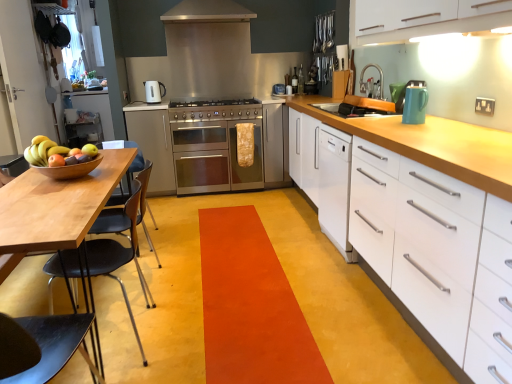
Question: Does white matte cabinet at right, positioned as the first cabinetry in right-to-left order, have a lesser height compared to stainless steel oven at center, which is counted as the 2th cabinetry, starting from the right?

Choices:
 (A) yes
 (B) no

Answer: (B)

Question: Does white matte cabinet at right, positioned as the 3th cabinetry in back-to-front order, have a greater width compared to stainless steel oven at center, which is counted as the 2th cabinetry, starting from the right?

Choices:
 (A) yes
 (B) no

Answer: (B)

Question: From a real-world perspective, is white matte cabinet at right, positioned as the first cabinetry in right-to-left order, beneath stainless steel oven at center, placed as the second cabinetry when sorted from front to back?

Choices:
 (A) no
 (B) yes

Answer: (B)

Question: From the image's perspective, is white matte cabinet at right, which ranks as the 1th cabinetry in front-to-back order, on top of stainless steel oven at center, placed as the second cabinetry when sorted from front to back?

Choices:
 (A) no
 (B) yes

Answer: (A)

Question: Does white matte cabinet at right, which ranks as the 1th cabinetry in front-to-back order, contain stainless steel oven at center, which is counted as the 2th cabinetry, starting from the right?

Choices:
 (A) yes
 (B) no

Answer: (B)

Question: From the image's perspective, is shiny wooden bowl at left positioned above or below white glossy cabinet at upper left, marked as the 1th cabinetry in a left-to-right arrangement?

Choices:
 (A) below
 (B) above

Answer: (A)

Question: Based on their sizes in the image, would you say shiny wooden bowl at left is bigger or smaller than white glossy cabinet at upper left, which ranks as the 3th cabinetry in right-to-left order?

Choices:
 (A) small
 (B) big

Answer: (A)

Question: Looking at their shapes, would you say shiny wooden bowl at left is wider or thinner than white glossy cabinet at upper left, the 1th cabinetry positioned from the back?

Choices:
 (A) wide
 (B) thin

Answer: (B)

Question: Based on their positions, is shiny wooden bowl at left located to the left or right of white glossy cabinet at upper left, acting as the third cabinetry starting from the front?

Choices:
 (A) left
 (B) right

Answer: (B)

Question: From the image's perspective, is stainless steel oven at center, the 2th cabinetry positioned from the back, located above or below black plastic chair at left?

Choices:
 (A) below
 (B) above

Answer: (B)

Question: Does point (161, 130) appear closer or farther from the camera than point (101, 231)?

Choices:
 (A) farther
 (B) closer

Answer: (A)

Question: Based on their positions, is stainless steel oven at center, which is counted as the 2th cabinetry, starting from the right, located to the left or right of black plastic chair at left?

Choices:
 (A) right
 (B) left

Answer: (B)

Question: In terms of height, does stainless steel oven at center, which is counted as the 2th cabinetry, starting from the right, look taller or shorter compared to black plastic chair at left?

Choices:
 (A) short
 (B) tall

Answer: (B)

Question: Looking at the image, does wooden bowl at left seem bigger or smaller compared to stainless steel oven at center, which is counted as the second cabinetry, starting from the left?

Choices:
 (A) small
 (B) big

Answer: (A)

Question: In the image, is wooden bowl at left positioned in front of or behind stainless steel oven at center, the 2th cabinetry positioned from the back?

Choices:
 (A) behind
 (B) front

Answer: (B)